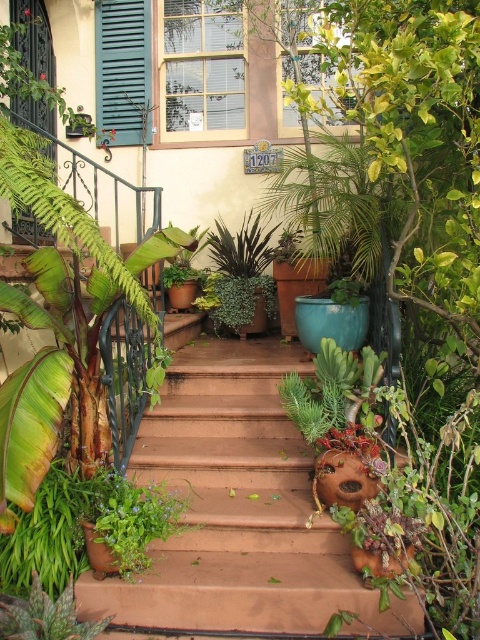
Question: Which point is closer to the camera?

Choices:
 (A) brown concrete stairs at center
 (B) green matte shutter at upper left

Answer: (A)

Question: Can you confirm if brown concrete stairs at center is bigger than green matte shutter at upper left?

Choices:
 (A) yes
 (B) no

Answer: (A)

Question: In this image, where is brown concrete stairs at center located relative to green matte shutter at upper left?

Choices:
 (A) right
 (B) left

Answer: (A)

Question: Observing the image, what is the correct spatial positioning of brown concrete stairs at center in reference to green matte shutter at upper left?

Choices:
 (A) left
 (B) right

Answer: (B)